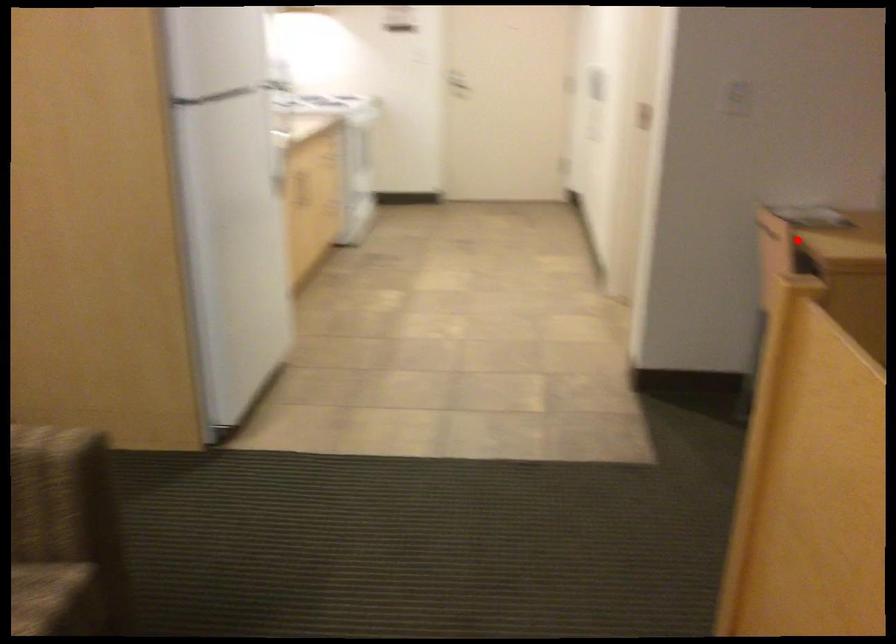
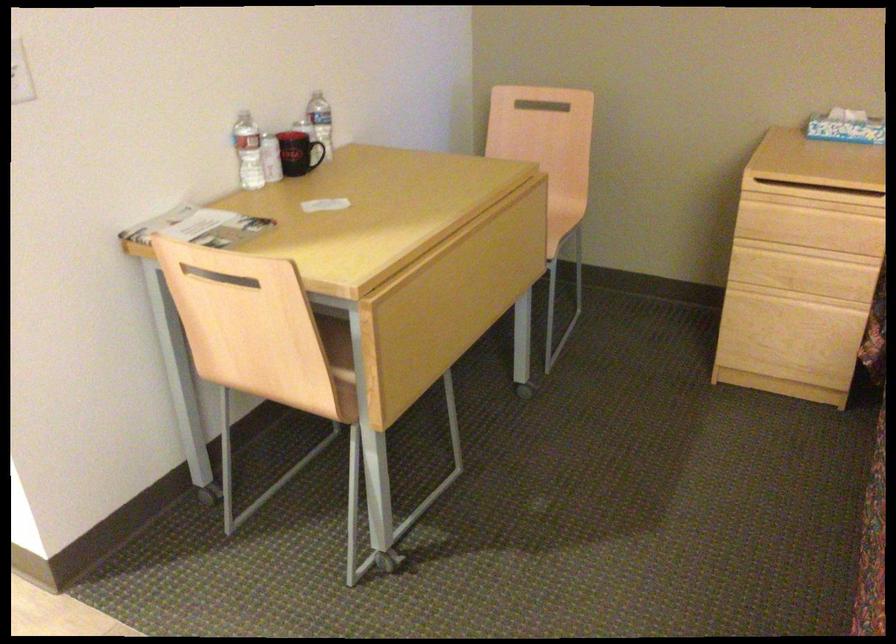
Locate, in the second image, the point that corresponds to the highlighted location in the first image.

(220, 277)